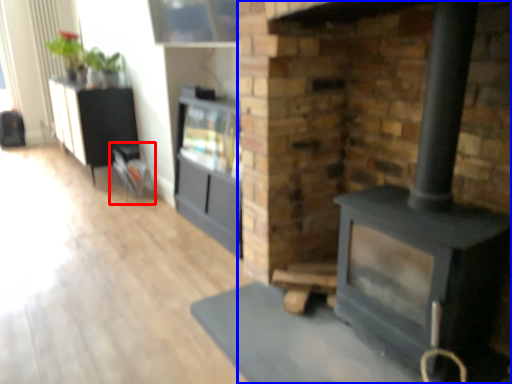
Question: Which object is closer to the camera taking this photo, furniture (highlighted by a red box) or fireplace (highlighted by a blue box)?

Choices:
 (A) furniture
 (B) fireplace

Answer: (B)